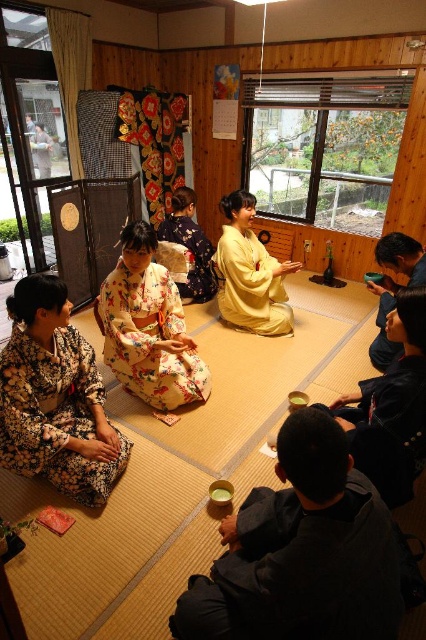
Is floral kimono at lower left below yellow silk kimono at center?

Indeed, floral kimono at lower left is positioned under yellow silk kimono at center.

From the picture: Is floral kimono at lower left further to the viewer compared to yellow silk kimono at center?

No, it is not.

The width and height of the screenshot is (426, 640). Find the location of `floral kimono at lower left`. floral kimono at lower left is located at coordinates (54, 397).

What are the coordinates of `floral kimono at lower left` in the screenshot? It's located at (54, 397).

Based on the photo, is floral silk kimono at center positioned at the back of black matte robe at lower right?

That is False.

Which is below, floral silk kimono at center or black matte robe at lower right?

black matte robe at lower right is lower down.

Which is behind, point (108, 330) or point (391, 300)?

The point (391, 300) is behind.

You are a GUI agent. You are given a task and a screenshot of the screen. Output one action in this format:
    pyautogui.click(x=<x>, y=<y>)
    Task: Click on the floral silk kimono at center
    The height and width of the screenshot is (640, 426).
    Given the screenshot: What is the action you would take?
    pyautogui.click(x=147, y=326)

Based on the photo, does black matte cup at lower center have a lesser width compared to floral silk kimono at center?

Yes.

In the scene shown: Is black matte cup at lower center below floral silk kimono at center?

Correct, black matte cup at lower center is located below floral silk kimono at center.

Is point (314, 554) closer to viewer compared to point (104, 307)?

Yes, point (314, 554) is closer to viewer.

Locate an element on the screen. The image size is (426, 640). black matte cup at lower center is located at coordinates (301, 572).